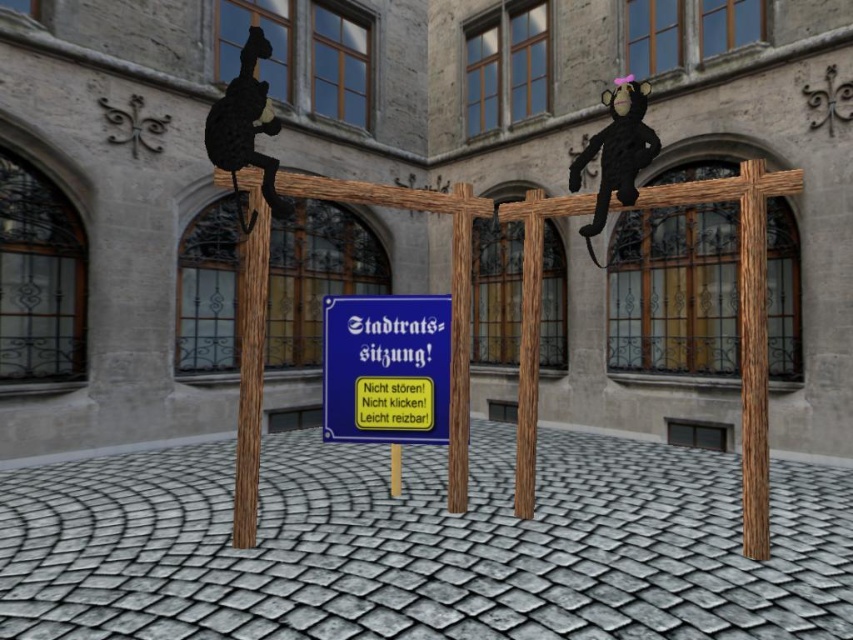
You are standing in the courtyard and see the wooden pole at left and the brown wood pole at center. Which pole is located to the left of the other?

The wooden pole at left is positioned on the left side of brown wood pole at center.

You are standing in the courtyard and want to place a small potted plant between the wooden pole at right and the wooden pole at center. Is there enough vertical space between them to fit the plant?

The wooden pole at right is positioned under the wooden pole at center, so there is vertical space between them. The potted plant can be placed between them vertically.

You are standing in the courtyard and want to hang a banner between the wooden pole at left and the brown wood pole at center. Which pole will the banner hang lower from?

The banner will hang lower from the wooden pole at left because it is shorter than the brown wood pole at center.